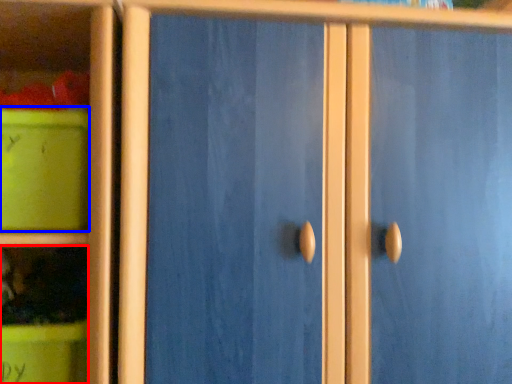
Question: Which point is closer to the camera, cabinet (highlighted by a red box) or storage box (highlighted by a blue box)?

Choices:
 (A) cabinet
 (B) storage box

Answer: (B)